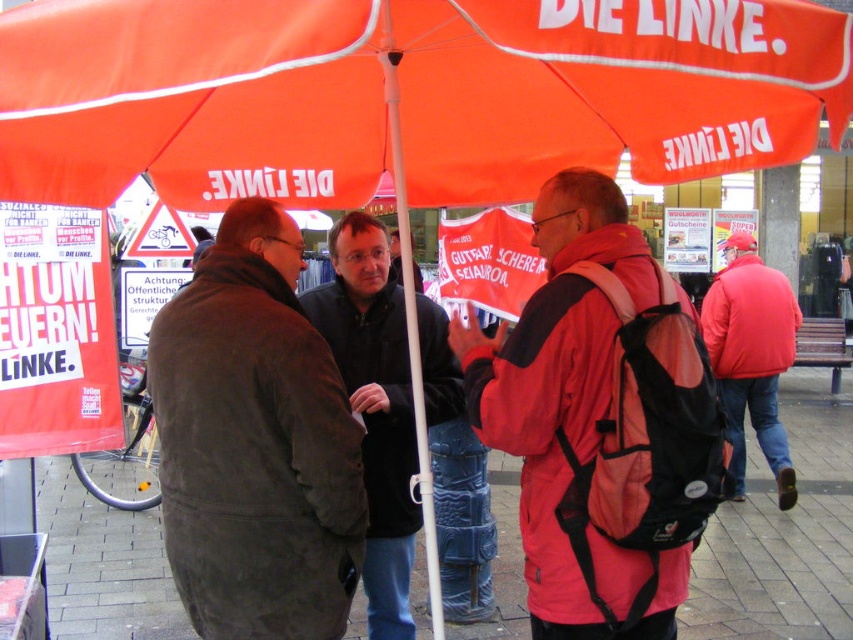
Is point (125, 173) farther from camera compared to point (398, 109)?

Yes, it is.

Who is more forward, (247, 61) or (397, 180)?

Point (247, 61) is more forward.

This screenshot has width=853, height=640. Find the location of `orange fabric canopy at upper center`. orange fabric canopy at upper center is located at coordinates (399, 92).

Is matte pink jacket with backpack at center bigger than dark gray suede coat at center?

Correct, matte pink jacket with backpack at center is larger in size than dark gray suede coat at center.

Between point (654, 304) and point (183, 456), which one is positioned in front?

Positioned in front is point (654, 304).

Find the location of `matte pink jacket with backpack at center`. matte pink jacket with backpack at center is located at coordinates (601, 420).

Based on the photo, is red matte jacket at right further to camera compared to white plastic pole at center?

Yes, red matte jacket at right is further from the viewer.

Measure the distance between red matte jacket at right and camera.

red matte jacket at right is 20.41 feet away from camera.

The width and height of the screenshot is (853, 640). Find the location of `red matte jacket at right`. red matte jacket at right is located at coordinates (751, 356).